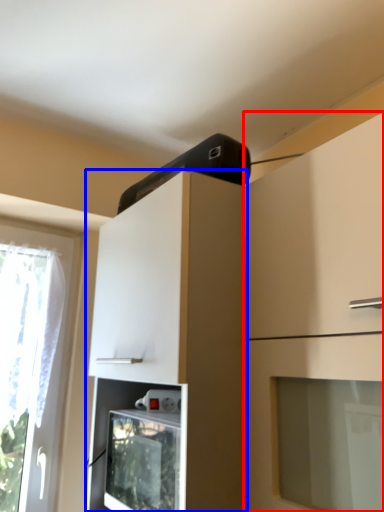
Question: Which object appears farthest to the camera in this image, cabinetry (highlighted by a red box) or cabinetry (highlighted by a blue box)?

Choices:
 (A) cabinetry
 (B) cabinetry

Answer: (B)